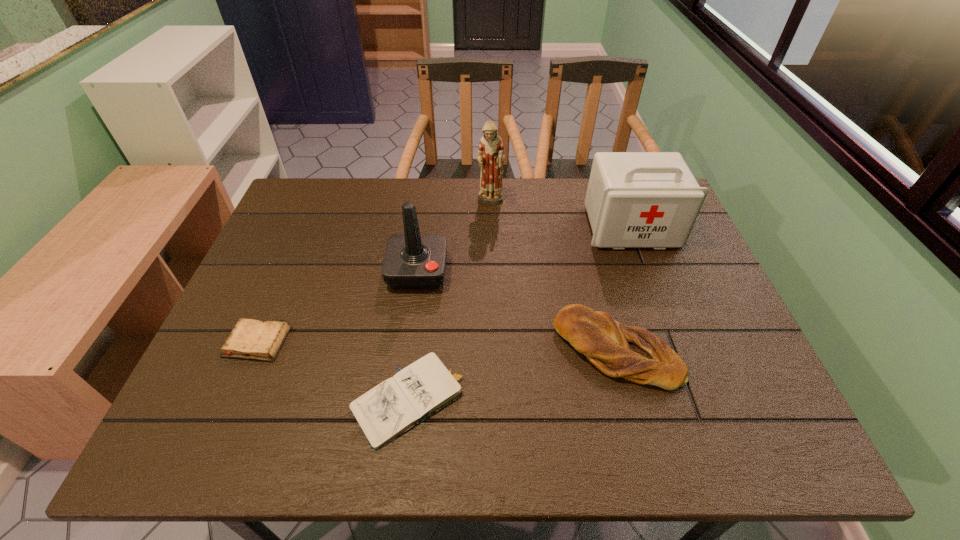
The width and height of the screenshot is (960, 540). I want to click on free space at the near edge of the desktop, so click(x=361, y=435).

I want to click on vacant point at the left edge, so click(x=309, y=245).

In the image, there is a desktop. Where is `free region at the right edge`? Image resolution: width=960 pixels, height=540 pixels. free region at the right edge is located at coordinates (703, 302).

Locate an element on the screen. The image size is (960, 540). free spot between the joystick and the fourth tallest object is located at coordinates (517, 310).

This screenshot has width=960, height=540. What are the coordinates of `free space between the diary and the fourth tallest object` in the screenshot? It's located at (437, 346).

I want to click on vacant space in between the first-aid kit and the diary, so click(444, 285).

I want to click on free point between the bread and the joystick, so click(517, 310).

Locate an element on the screen. This screenshot has height=540, width=960. vacant space that's between the leftmost object and the third farthest object is located at coordinates (337, 307).

I want to click on unoccupied area between the notebook and the third farthest object, so click(415, 336).

Where is `free spot between the notebook and the figurine`? free spot between the notebook and the figurine is located at coordinates (451, 301).